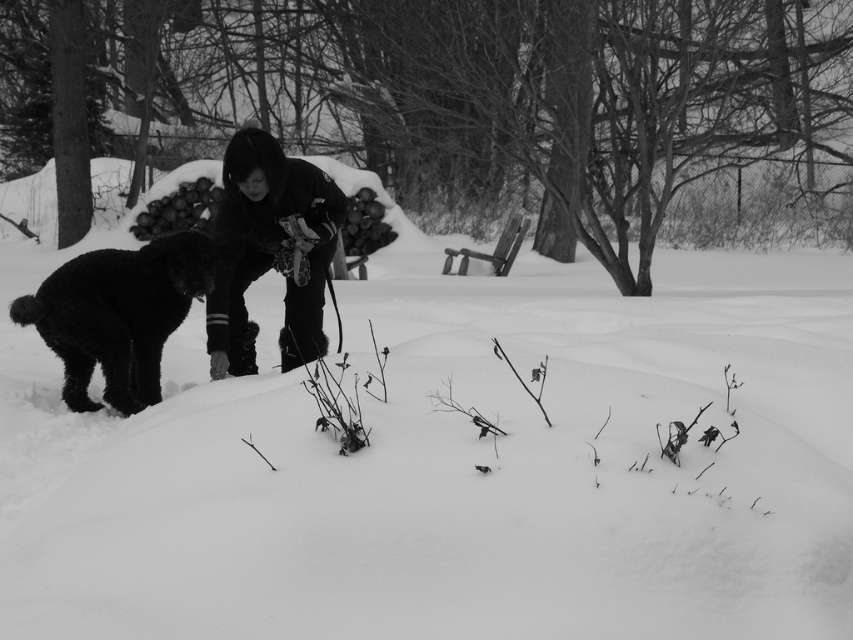
Does dark fabric jacket at center lie in front of black fur dog at left?

Yes, dark fabric jacket at center is in front of black fur dog at left.

Is dark fabric jacket at center below black fur dog at left?

No, dark fabric jacket at center is not below black fur dog at left.

The width and height of the screenshot is (853, 640). What are the coordinates of `dark fabric jacket at center` in the screenshot? It's located at (270, 250).